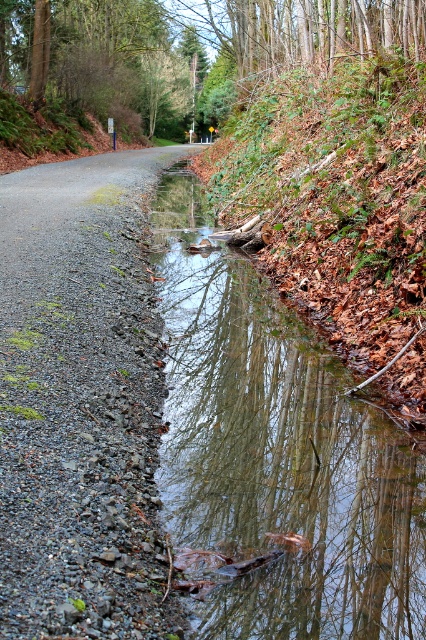
Question: Observing the image, what is the correct spatial positioning of clear water at center in reference to gray gravel road at center?

Choices:
 (A) right
 (B) left

Answer: (A)

Question: Can you confirm if gray gravel road at center is thinner than brown textured tree at upper center?

Choices:
 (A) yes
 (B) no

Answer: (A)

Question: Among these objects, which one is farthest from the camera?

Choices:
 (A) brown leafy hillside at upper right
 (B) clear water at center
 (C) brown textured tree at upper center
 (D) gray gravel road at center

Answer: (C)

Question: Does gray gravel road at center appear on the left side of brown leafy hillside at upper right?

Choices:
 (A) no
 (B) yes

Answer: (B)

Question: Which point appears farthest from the camera in this image?

Choices:
 (A) (284, 156)
 (B) (344, 51)

Answer: (B)

Question: Which point is farther to the camera?

Choices:
 (A) (106, 99)
 (B) (308, 493)
 (C) (302, 259)
 (D) (97, 273)

Answer: (A)